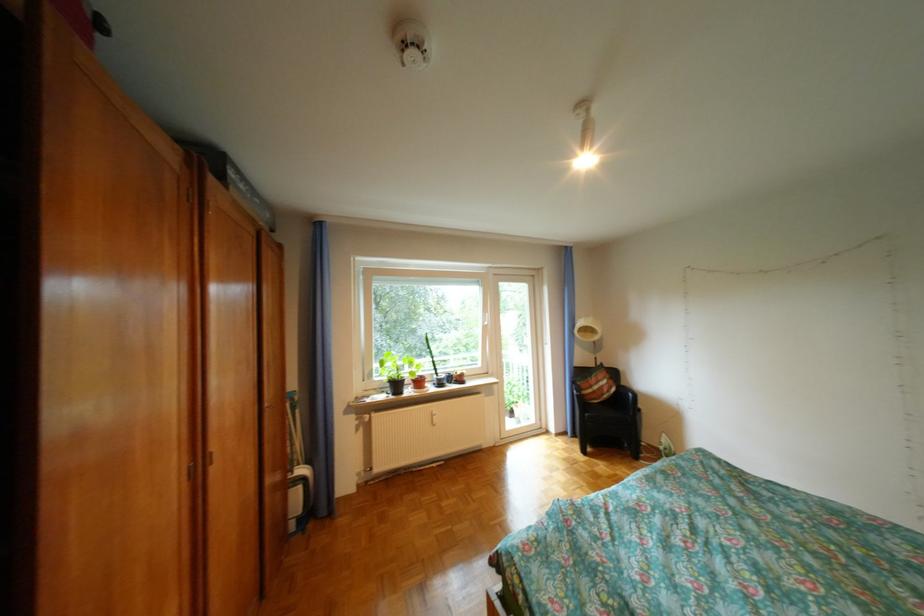
I want to click on black chair armrest, so click(x=578, y=407).